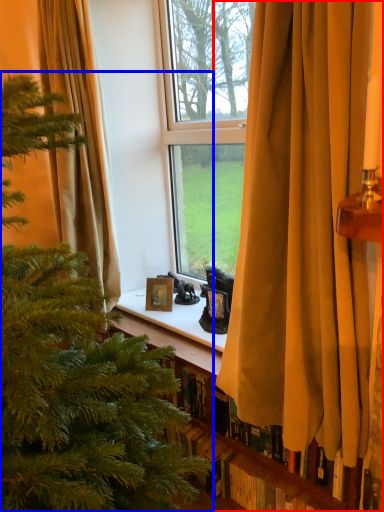
Question: Among these objects, which one is nearest to the camera, curtain (highlighted by a red box) or christmas tree (highlighted by a blue box)?

Choices:
 (A) curtain
 (B) christmas tree

Answer: (B)